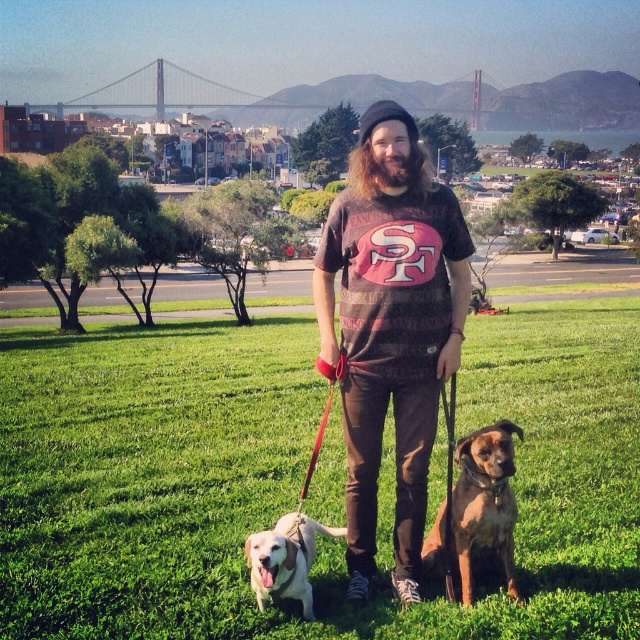
You are a dog trainer assessing the scene. You need to determine which dog is taller between the brown leather dog at lower right and the white fur dog at lower left. Based on the scene description, which dog is taller?

The brown leather dog at lower right is taller than the white fur dog at lower left according to the description.

You are a photographer trying to capture a photo of both the brown leather dog at lower right and the white fur dog at lower left. Based on their positions, which dog should you focus on first to ensure they are both in the frame?

The brown leather dog at lower right is above the white fur dog at lower left, so you should focus on the brown leather dog at lower right first to ensure both are in the frame.